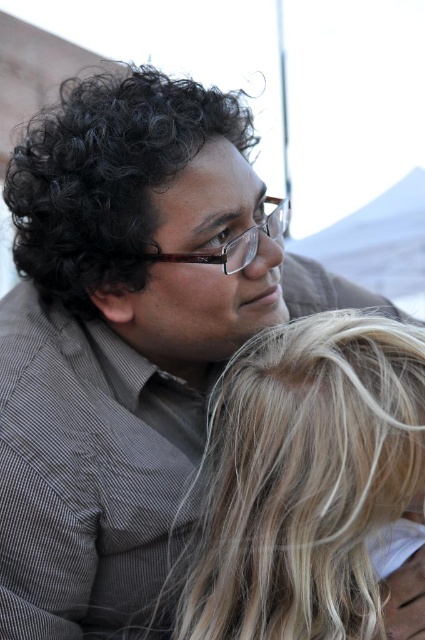
You are a photographer trying to capture a portrait of the blonde hair at center and the black curly hair at upper left. The minimum distance between the two subjects required for your camera lens to focus properly is 20 inches. Based on the scene, will your camera be able to focus on both subjects simultaneously?

The blonde hair at center and black curly hair at upper left are 20.98 inches apart, which exceeds the minimum required distance of 20 inches. Therefore, the camera can focus on both subjects simultaneously.

You are standing in the outdoor setting shown in the image. There are two points marked in the scene. The first point is at coordinates point (x=282, y=596) and the second point is at point (x=68, y=260). Which point is closer to you?

Point (x=282, y=596) is in front of point (x=68, y=260), so it is closer to you.

Based on the scene description, which object is closer to the viewer between the blonde hair at center and the black curly hair at upper left?

The blonde hair at center is closer to the viewer because it is in front of the black curly hair at upper left.